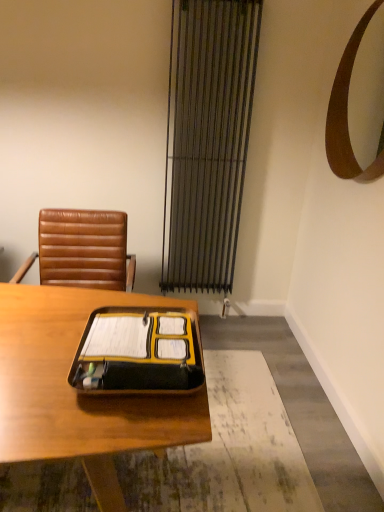
This screenshot has height=512, width=384. What are the coordinates of `free space to the left of yellow matte folder at center` in the screenshot? It's located at (47, 331).